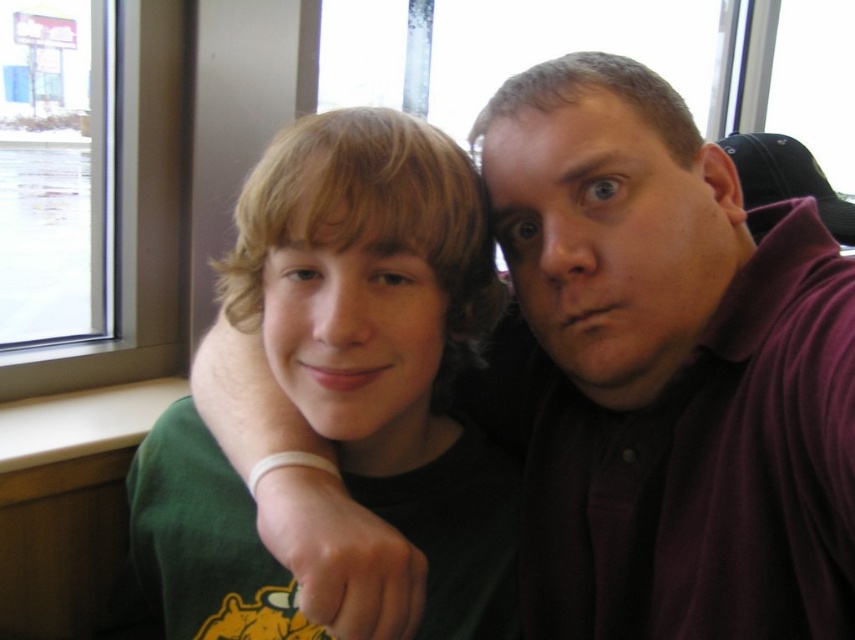
Does green matte shirt at center have a lesser width compared to transparent glass window at upper left?

No.

Is point (193, 428) closer to camera compared to point (74, 65)?

Yes, it is.

Who is more distant from viewer, (230, 525) or (95, 20)?

Point (95, 20)

In order to click on green matte shirt at center in this screenshot , I will do `click(384, 333)`.